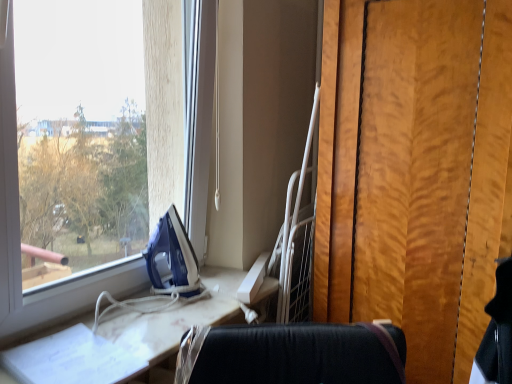
Locate an element on the screen. free location to the right of blue plastic iron at window is located at coordinates (222, 296).